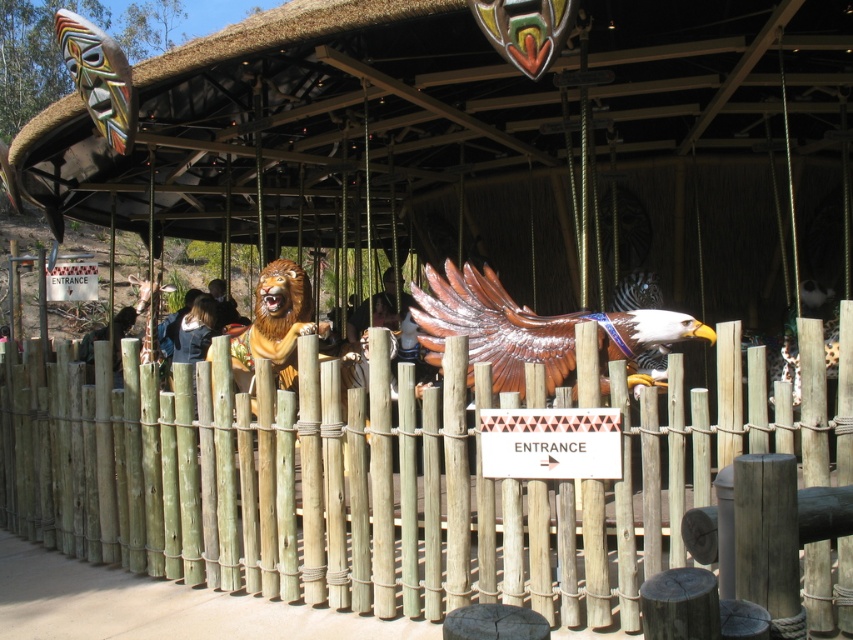
Who is positioned more to the left, green bamboo fence at center or brown wooden eagle at center?

From the viewer's perspective, green bamboo fence at center appears more on the left side.

Which of these two, green bamboo fence at center or brown wooden eagle at center, stands taller?

Standing taller between the two is green bamboo fence at center.

I want to click on green bamboo fence at center, so click(328, 484).

This screenshot has height=640, width=853. Identify the location of green bamboo fence at center. (328, 484).

Image resolution: width=853 pixels, height=640 pixels. I want to click on brown wooden eagle at center, so click(x=532, y=328).

Is the position of brown wooden eagle at center more distant than that of smooth brown hair at center?

That is False.

Does point (434, 285) come farther from viewer compared to point (227, 305)?

No, (434, 285) is closer to viewer.

Identify the location of brown wooden eagle at center. click(x=532, y=328).

Does green bamboo fence at center lie behind smooth brown hair at center?

No, green bamboo fence at center is in front of smooth brown hair at center.

Can you confirm if green bamboo fence at center is thinner than smooth brown hair at center?

→ In fact, green bamboo fence at center might be wider than smooth brown hair at center.

At what (x,y) coordinates should I click in order to perform the action: click on green bamboo fence at center. Please return your answer as a coordinate pair (x, y). Looking at the image, I should click on 328,484.